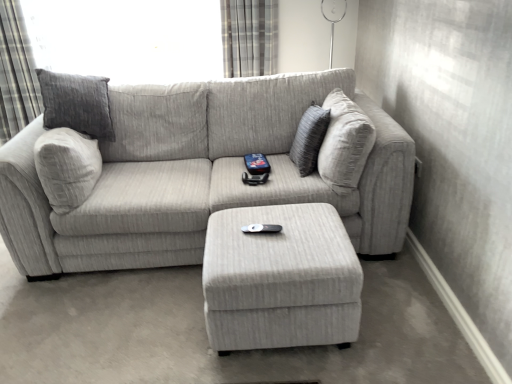
At what (x,y) coordinates should I click in order to perform the action: click on vacant area on top of light gray fabric ottoman at center (from a real-world perspective). Please return your answer as a coordinate pair (x, y). The width and height of the screenshot is (512, 384). Looking at the image, I should click on (278, 234).